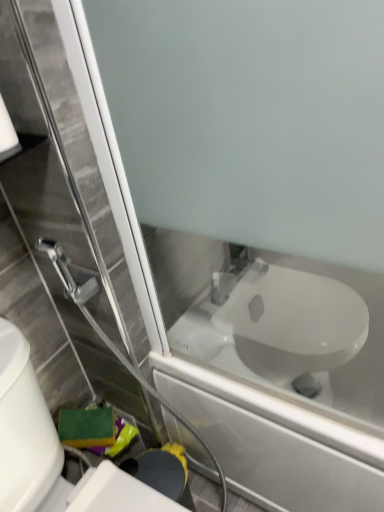
Question: In terms of size, does white glossy toilet at lower right appear bigger or smaller than white matte toilet paper at upper left?

Choices:
 (A) big
 (B) small

Answer: (A)

Question: Looking at their shapes, would you say white glossy toilet at lower right is wider or thinner than white matte toilet paper at upper left?

Choices:
 (A) thin
 (B) wide

Answer: (B)

Question: Which is farther from the white matte toilet paper at upper left?

Choices:
 (A) white glossy toilet at lower right
 (B) white glossy toilet at center

Answer: (B)

Question: Estimate the real-world distances between objects in this image. Which object is closer to the white glossy toilet at lower right?

Choices:
 (A) white glossy toilet at center
 (B) white matte toilet paper at upper left

Answer: (A)